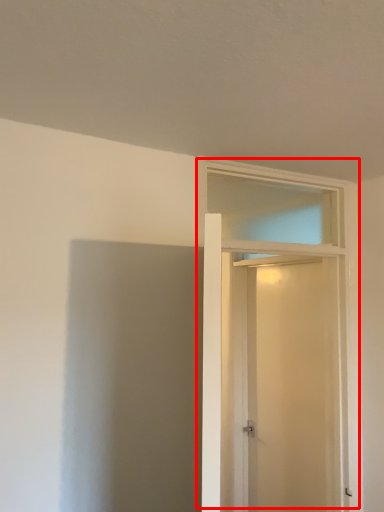
Question: Considering the relative positions of door (annotated by the red box) and screen door in the image provided, where is door (annotated by the red box) located with respect to the staircase?

Choices:
 (A) right
 (B) left

Answer: (B)